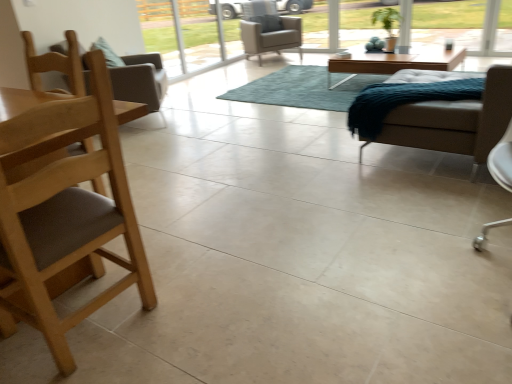
Question: From the image's perspective, is transparent glass screen door at upper center under white leather chair at right, which appears as the 2th chair when viewed from the front?

Choices:
 (A) yes
 (B) no

Answer: (B)

Question: Could white leather chair at right, arranged as the 3th chair when viewed from the top, be considered to be inside transparent glass screen door at upper center?

Choices:
 (A) yes
 (B) no

Answer: (B)

Question: From a real-world perspective, is transparent glass screen door at upper center positioned over white leather chair at right, which appears as the third chair when viewed from the back, based on gravity?

Choices:
 (A) yes
 (B) no

Answer: (A)

Question: Considering the relative positions of transparent glass screen door at upper center and white leather chair at right, which appears as the third chair when viewed from the back, in the image provided, is transparent glass screen door at upper center to the left of white leather chair at right, which appears as the third chair when viewed from the back, from the viewer's perspective?

Choices:
 (A) no
 (B) yes

Answer: (B)

Question: Could you tell me if transparent glass screen door at upper center is facing white leather chair at right, which is the 2th chair in bottom-to-top order?

Choices:
 (A) yes
 (B) no

Answer: (A)

Question: Is transparent glass screen door at upper center looking in the opposite direction of white leather chair at right, which is the 2th chair in bottom-to-top order?

Choices:
 (A) yes
 (B) no

Answer: (B)

Question: Can you confirm if white leather chair at right, which is the 2th chair in bottom-to-top order, is shorter than brown wood chair at left, which appears as the 4th chair when viewed from the back?

Choices:
 (A) yes
 (B) no

Answer: (A)

Question: Considering the relative positions of white leather chair at right, arranged as the 3th chair when viewed from the top, and brown wood chair at left, marked as the first chair in a front-to-back arrangement, in the image provided, is white leather chair at right, arranged as the 3th chair when viewed from the top, to the right of brown wood chair at left, marked as the first chair in a front-to-back arrangement, from the viewer's perspective?

Choices:
 (A) yes
 (B) no

Answer: (A)

Question: Is white leather chair at right, arranged as the 3th chair when viewed from the top, outside brown wood chair at left, which is the first chair in bottom-to-top order?

Choices:
 (A) no
 (B) yes

Answer: (B)

Question: Is brown wood chair at left, which is the first chair in bottom-to-top order, surrounded by white leather chair at right, which is the 2th chair in bottom-to-top order?

Choices:
 (A) yes
 (B) no

Answer: (B)

Question: Considering the relative sizes of white leather chair at right, which is the 2th chair in bottom-to-top order, and brown wood chair at left, which is the first chair in bottom-to-top order, in the image provided, is white leather chair at right, which is the 2th chair in bottom-to-top order, bigger than brown wood chair at left, which is the first chair in bottom-to-top order,?

Choices:
 (A) no
 (B) yes

Answer: (A)

Question: From a real-world perspective, does white leather chair at right, which is the 2th chair in bottom-to-top order, sit lower than brown wood chair at left, which is the first chair in bottom-to-top order?

Choices:
 (A) yes
 (B) no

Answer: (A)

Question: Considering the relative positions of teal shaggy rug at center and light brown leather armchair at center, the fourth chair ordered from the bottom, in the image provided, is teal shaggy rug at center to the left of light brown leather armchair at center, the fourth chair ordered from the bottom, from the viewer's perspective?

Choices:
 (A) no
 (B) yes

Answer: (A)